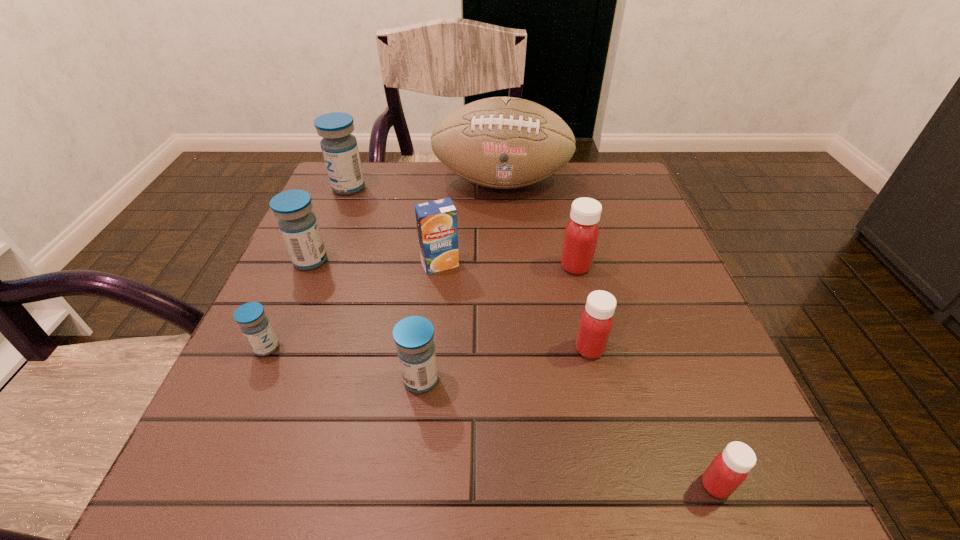
I want to click on football (American), so click(500, 142).

I want to click on the biggest blue medicine, so click(339, 147).

Find the location of `the farthest blue medicine`. the farthest blue medicine is located at coordinates (339, 147).

This screenshot has height=540, width=960. In order to click on the farthest red medicine in this screenshot , I will do `click(581, 235)`.

Locate an element on the screen. the third nearest blue medicine is located at coordinates (298, 225).

Where is `orange_juice`? orange_juice is located at coordinates (436, 220).

You are a GUI agent. You are given a task and a screenshot of the screen. Output one action in this format:
    pyautogui.click(x=<x>, y=<y>)
    Task: Click on the second biggest red medicine
    
    Given the screenshot: What is the action you would take?
    pyautogui.click(x=596, y=322)

The image size is (960, 540). In order to click on the second smallest blue medicine in this screenshot , I will do `click(414, 336)`.

You are a GUI agent. You are given a task and a screenshot of the screen. Output one action in this format:
    pyautogui.click(x=<x>, y=<y>)
    Task: Click on the nearest blue medicine
    The width and height of the screenshot is (960, 540).
    Given the screenshot: What is the action you would take?
    pyautogui.click(x=414, y=336)

This screenshot has width=960, height=540. In order to click on the smallest blue medicine in this screenshot , I will do `click(251, 317)`.